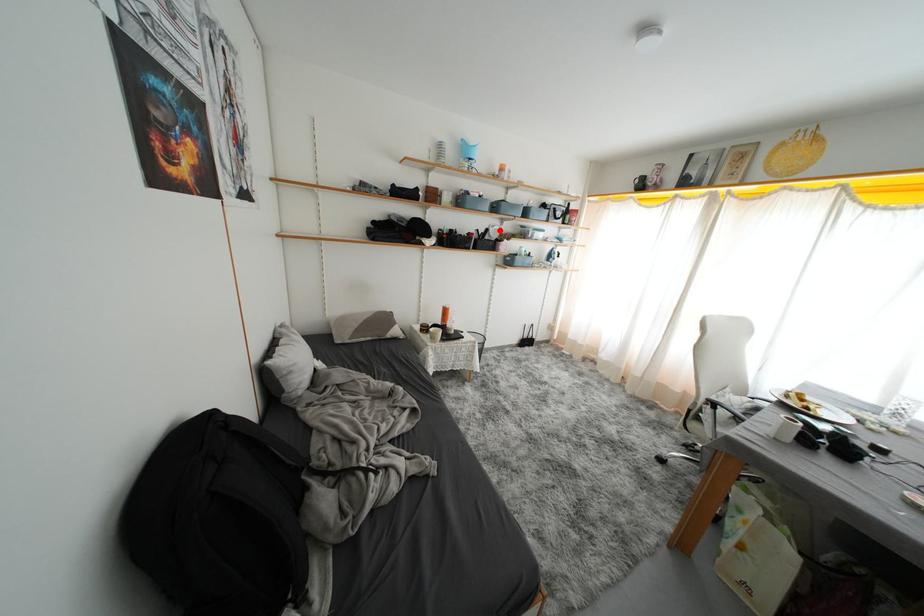
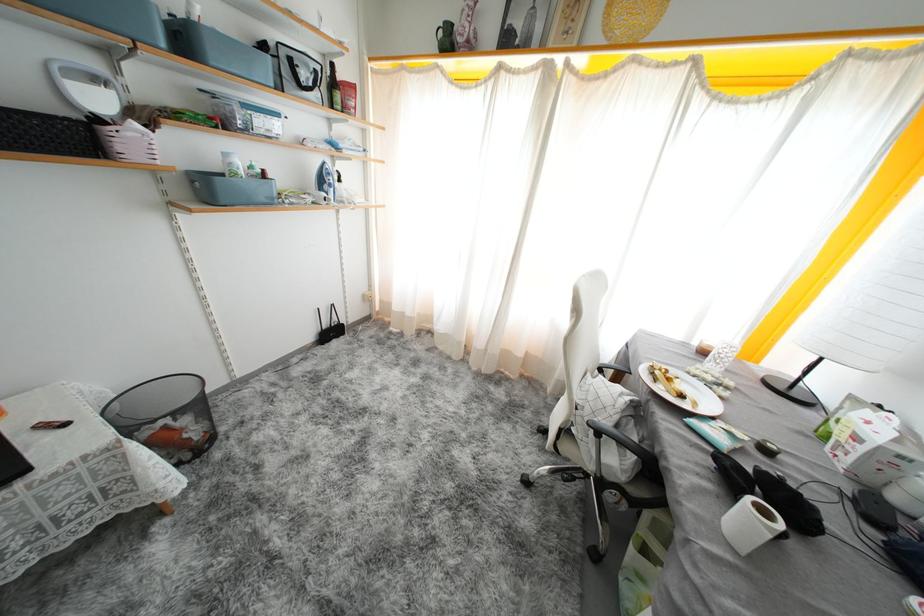
The point at the highlighted location is marked in the first image. Where is the corresponding point in the second image?

(103, 84)